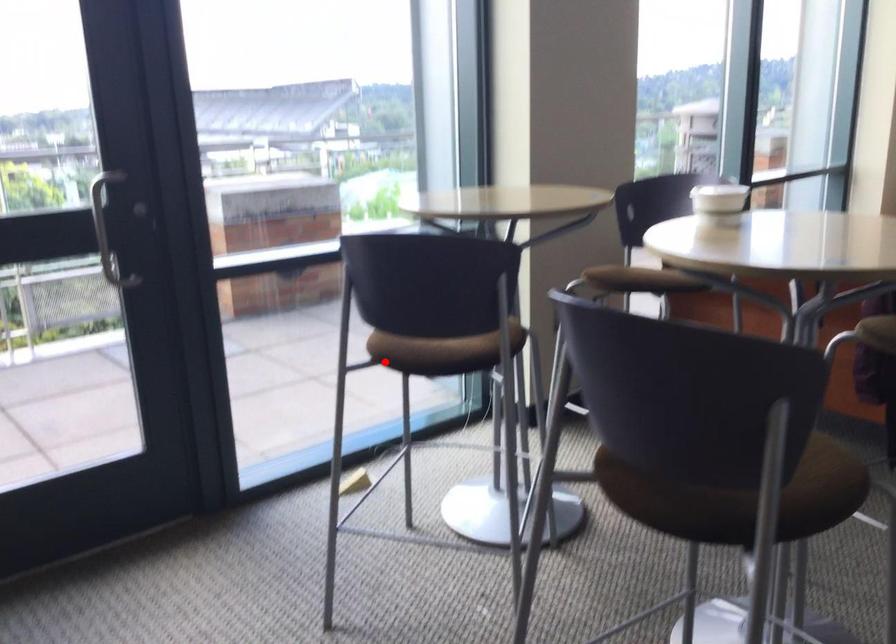
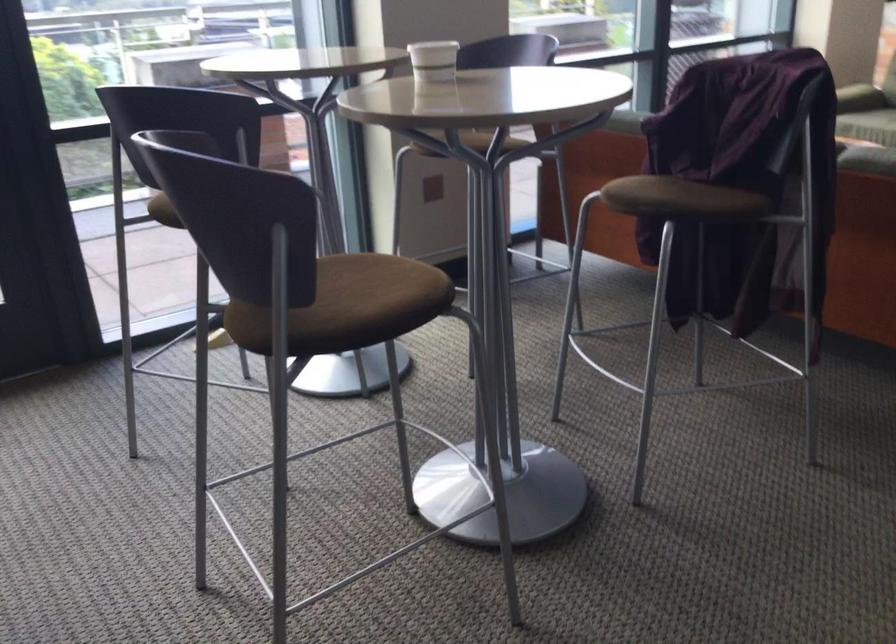
Where in the second image is the point corresponding to the highlighted location from the first image?

(162, 211)